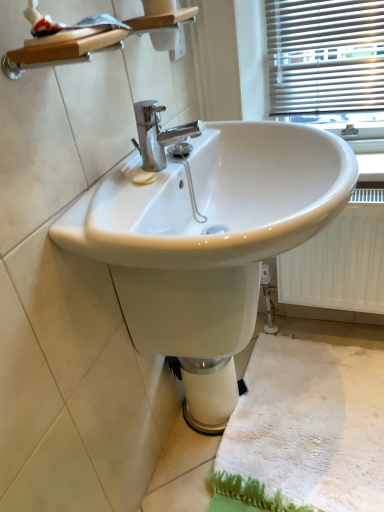
I want to click on white textured radiator at lower right, so click(340, 261).

Measure the distance between white fluffy bath mat at lower right and camera.

The distance of white fluffy bath mat at lower right from camera is 1.05 meters.

Locate an element on the screen. The height and width of the screenshot is (512, 384). white fluffy bath mat at lower right is located at coordinates (306, 429).

The image size is (384, 512). Describe the element at coordinates (208, 229) in the screenshot. I see `white glossy sink at center` at that location.

You are a GUI agent. You are given a task and a screenshot of the screen. Output one action in this format:
    pyautogui.click(x=<x>, y=<y>)
    Task: Click on the white textured radiator at lower right
    The image size is (384, 512).
    Given the screenshot: What is the action you would take?
    pyautogui.click(x=340, y=261)

From the image's perspective, who appears lower, white fluffy bath mat at lower right or white glossy sink at center?

white fluffy bath mat at lower right appears lower in the image.

In the scene shown: From a real-world perspective, which object stands above the other?

From a 3D spatial view, white glossy sink at center is above.

Is white fluffy bath mat at lower right smaller than white glossy sink at center?

Indeed, white fluffy bath mat at lower right has a smaller size compared to white glossy sink at center.

Is white glossy sink at center at the back of white fluffy bath mat at lower right?

No, white fluffy bath mat at lower right is not facing the opposite direction of white glossy sink at center.

Considering the relative sizes of white glossy sink at center and white textured radiator at lower right in the image provided, is white glossy sink at center smaller than white textured radiator at lower right?

No, white glossy sink at center is not smaller than white textured radiator at lower right.

From the image's perspective, which is above, white glossy sink at center or white textured radiator at lower right?

white glossy sink at center appears higher in the image.

Between white glossy sink at center and white textured radiator at lower right, which one has more height?

Standing taller between the two is white textured radiator at lower right.

Can you tell me how much white fluffy bath mat at lower right and white textured radiator at lower right differ in facing direction?

0.305 degrees.

Considering the points (267, 346) and (320, 255), which point is behind, point (267, 346) or point (320, 255)?

The point (267, 346) is behind.

From the image's perspective, between white fluffy bath mat at lower right and white textured radiator at lower right, who is located below?

white fluffy bath mat at lower right.

Considering the sizes of white fluffy bath mat at lower right and white textured radiator at lower right in the image, is white fluffy bath mat at lower right bigger or smaller than white textured radiator at lower right?

In the image, white fluffy bath mat at lower right appears to be smaller than white textured radiator at lower right.

How different are the orientations of white textured radiator at lower right and white fluffy bath mat at lower right in degrees?

white textured radiator at lower right and white fluffy bath mat at lower right are facing 0.305 degrees away from each other.

Can you confirm if white textured radiator at lower right is taller than white fluffy bath mat at lower right?

Indeed, white textured radiator at lower right has a greater height compared to white fluffy bath mat at lower right.

From the picture: From the image's perspective, does white textured radiator at lower right appear higher than white fluffy bath mat at lower right?

Indeed, from the image's perspective, white textured radiator at lower right is shown above white fluffy bath mat at lower right.

Would you say white textured radiator at lower right is a long distance from white fluffy bath mat at lower right?

white textured radiator at lower right is near white fluffy bath mat at lower right, not far away.

Is point (284, 295) farther from viewer compared to point (328, 182)?

Yes, it is.

Find the location of `sink in front of the white textured radiator at lower right`. sink in front of the white textured radiator at lower right is located at coordinates (208, 229).

Is white glossy sink at center a part of white textured radiator at lower right?

Actually, white glossy sink at center is outside white textured radiator at lower right.

From a real-world perspective, is white glossy sink at center over white fluffy bath mat at lower right?

Correct, in the physical world, white glossy sink at center is higher than white fluffy bath mat at lower right.

Could you tell me if white glossy sink at center is facing white fluffy bath mat at lower right?

No, white glossy sink at center is not turned towards white fluffy bath mat at lower right.

Is white glossy sink at center inside or outside of white fluffy bath mat at lower right?

white glossy sink at center lies outside white fluffy bath mat at lower right.

Looking at this image, does white glossy sink at center have a lesser height compared to white fluffy bath mat at lower right?

In fact, white glossy sink at center may be taller than white fluffy bath mat at lower right.

Find the location of a particular element. The width and height of the screenshot is (384, 512). bath mat below the white glossy sink at center (from a real-world perspective) is located at coordinates (306, 429).

Where is `sink on the left side of white textured radiator at lower right`? The width and height of the screenshot is (384, 512). sink on the left side of white textured radiator at lower right is located at coordinates (208, 229).

Which object lies nearer to the anchor point white textured radiator at lower right, white fluffy bath mat at lower right or white glossy sink at center?

Among the two, white fluffy bath mat at lower right is located nearer to white textured radiator at lower right.

Which object lies nearer to the anchor point white glossy sink at center, white textured radiator at lower right or white fluffy bath mat at lower right?

white textured radiator at lower right.

Considering their positions, is white fluffy bath mat at lower right positioned closer to white glossy sink at center than white textured radiator at lower right?

The object closer to white glossy sink at center is white textured radiator at lower right.

Looking at the image, which one is located further to white fluffy bath mat at lower right, white glossy sink at center or white textured radiator at lower right?

white glossy sink at center.

Which object lies nearer to the anchor point white fluffy bath mat at lower right, white textured radiator at lower right or white glossy sink at center?

Among the two, white textured radiator at lower right is located nearer to white fluffy bath mat at lower right.

From the image, which object appears to be farther from white textured radiator at lower right, white glossy sink at center or white fluffy bath mat at lower right?

The object further to white textured radiator at lower right is white glossy sink at center.

Image resolution: width=384 pixels, height=512 pixels. Find the location of `bath mat positioned between white glossy sink at center and white textured radiator at lower right from near to far`. bath mat positioned between white glossy sink at center and white textured radiator at lower right from near to far is located at coordinates (306, 429).